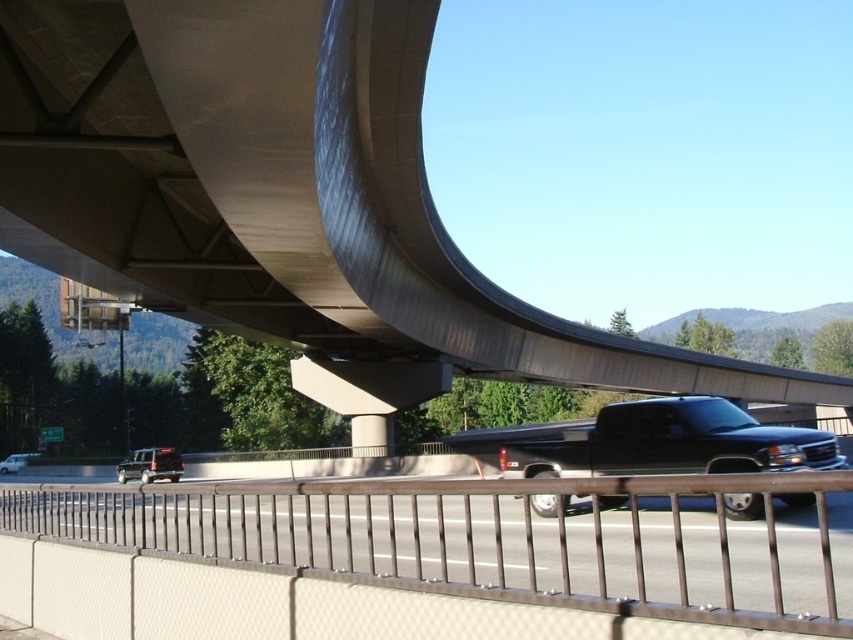
Question: Which point is closer to the camera?

Choices:
 (A) (39, 531)
 (B) (0, 465)
 (C) (729, 412)

Answer: (A)

Question: Does black glossy truck at center have a greater width compared to silver metallic sedan at lower left?

Choices:
 (A) no
 (B) yes

Answer: (B)

Question: Which point is farther to the camera?

Choices:
 (A) (643, 564)
 (B) (9, 4)
 (C) (167, 452)
 (D) (657, 449)

Answer: (C)

Question: Which of the following is the closest to the observer?

Choices:
 (A) silver metallic sedan at lower left
 (B) black glossy truck at center
 (C) matte black suv at lower left

Answer: (B)

Question: Is the position of matte black suv at lower left more distant than that of silver metallic sedan at lower left?

Choices:
 (A) no
 (B) yes

Answer: (A)

Question: Is matte black suv at lower left below silver metallic sedan at lower left?

Choices:
 (A) no
 (B) yes

Answer: (A)